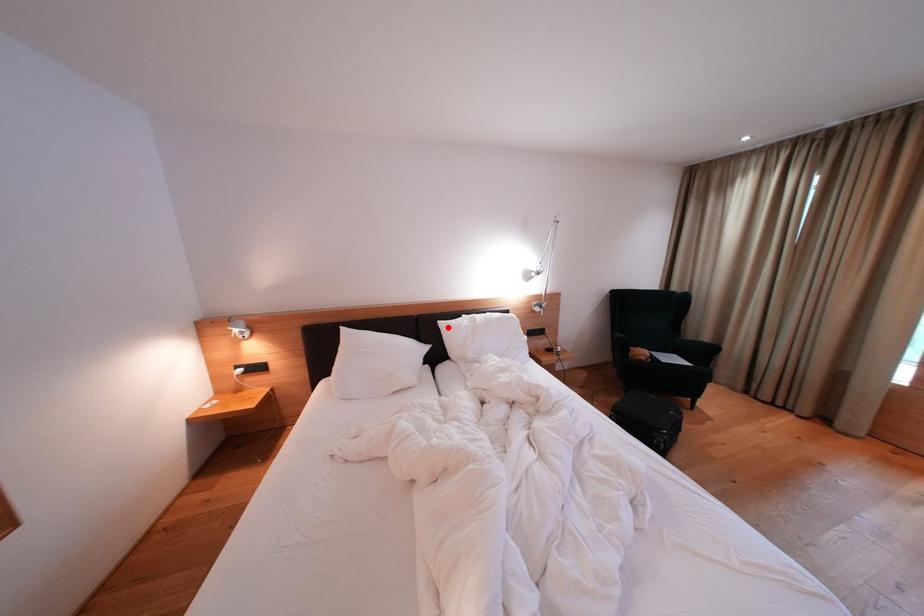
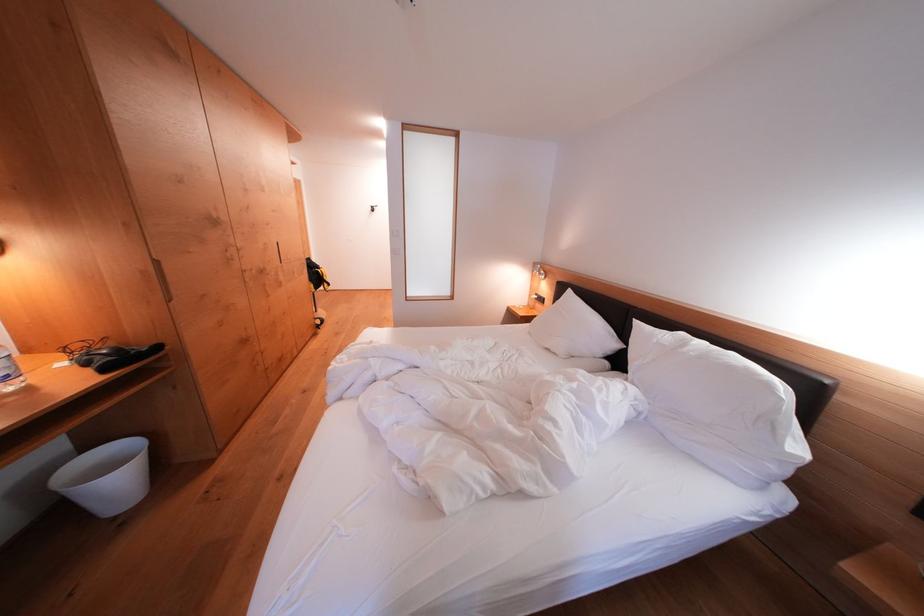
Question: I am providing you with two images of the same scene from different viewpoints. In image1, a red point is highlighted. Considering the same 3D point in image2, which of the following is correct?

Choices:
 (A) It is closer
 (B) It is farther

Answer: (A)